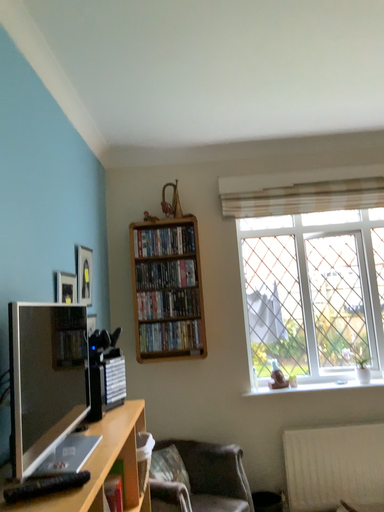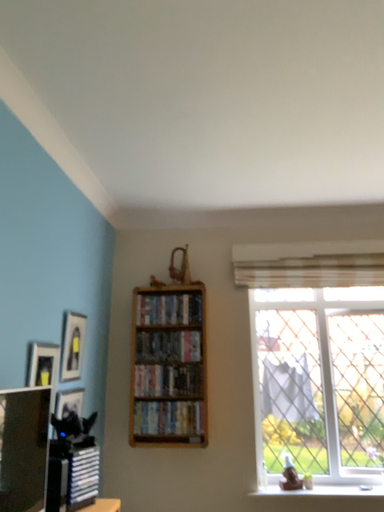
Question: How did the camera likely rotate when shooting the video?

Choices:
 (A) rotated upward
 (B) rotated downward

Answer: (A)